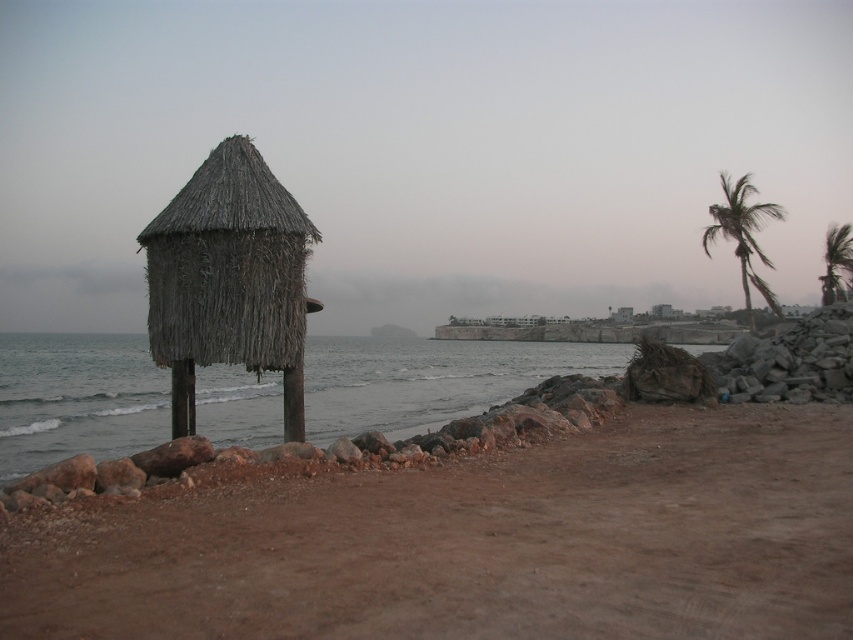
Question: Does brown sandy beach at lower left appear under gray water at center?

Choices:
 (A) yes
 (B) no

Answer: (A)

Question: Is gray water at center positioned before green leafy palm tree at right?

Choices:
 (A) yes
 (B) no

Answer: (A)

Question: Which of the following is the farthest from the observer?

Choices:
 (A) (276, 253)
 (B) (840, 259)
 (C) (726, 212)
 (D) (482, 611)

Answer: (B)

Question: Which object is the closest to the green leafy palm tree at right?

Choices:
 (A) green leafy palm tree at upper right
 (B) gray water at center
 (C) brown sandy beach at lower left
 (D) thatched straw hut at left

Answer: (A)

Question: Estimate the real-world distances between objects in this image. Which object is farther from the brown sandy beach at lower left?

Choices:
 (A) gray water at center
 (B) green leafy palm tree at right
 (C) thatched straw hut at left

Answer: (A)

Question: Can you confirm if thatched straw hut at left is positioned to the right of green leafy palm tree at right?

Choices:
 (A) no
 (B) yes

Answer: (A)